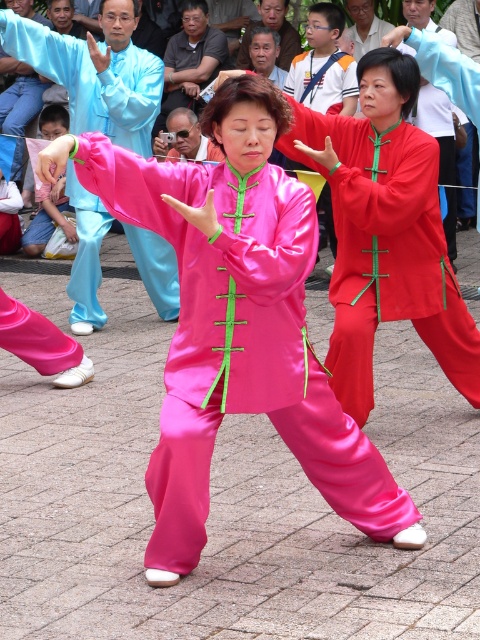
Question: Which of the following is the farthest from the observer?

Choices:
 (A) light blue satin robe at left
 (B) light blue silk shirt at upper center
 (C) satin pink pantsuit at center
 (D) smooth brown face at upper center

Answer: (D)

Question: Which object is positioned closest to the silky red pants at center?

Choices:
 (A) light blue silk shirt at upper center
 (B) satin pink pantsuit at center
 (C) smooth brown face at upper center
 (D) light blue satin robe at left

Answer: (B)

Question: Is light blue satin robe at left further to the viewer compared to light blue silk shirt at upper center?

Choices:
 (A) yes
 (B) no

Answer: (B)

Question: Is satin pink pantsuit at center wider than smooth brown face at upper center?

Choices:
 (A) yes
 (B) no

Answer: (A)

Question: Which object appears closest to the camera in this image?

Choices:
 (A) satin pink pantsuit at center
 (B) smooth brown face at upper center
 (C) light blue silk shirt at upper center
 (D) light blue satin robe at left

Answer: (A)

Question: Is silky red pants at center positioned behind smooth brown face at upper center?

Choices:
 (A) yes
 (B) no

Answer: (B)